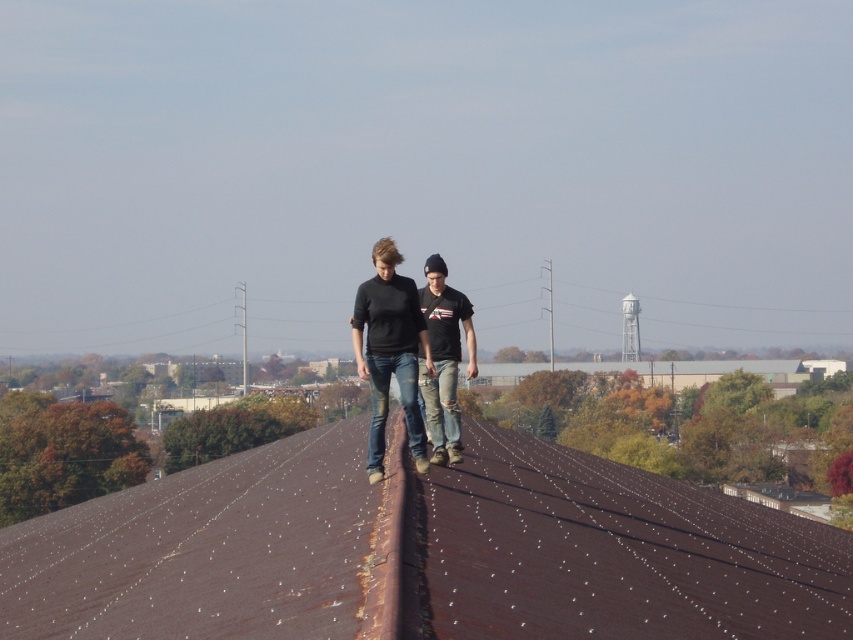
Question: Can you confirm if brown rusted metal roof at center is wider than ripped denim jeans at center?

Choices:
 (A) yes
 (B) no

Answer: (A)

Question: From the image, what is the correct spatial relationship of brown rusted metal roof at center in relation to denim jeans at center?

Choices:
 (A) left
 (B) right

Answer: (B)

Question: Which point appears farthest from the camera in this image?

Choices:
 (A) (451, 364)
 (B) (381, 321)

Answer: (A)

Question: Which object is closer to the camera taking this photo?

Choices:
 (A) denim jeans at center
 (B) ripped denim jeans at center

Answer: (A)

Question: Is brown rusted metal roof at center smaller than ripped denim jeans at center?

Choices:
 (A) yes
 (B) no

Answer: (B)

Question: Which object is the farthest from the brown rusted metal roof at center?

Choices:
 (A) denim jeans at center
 (B) ripped denim jeans at center

Answer: (A)